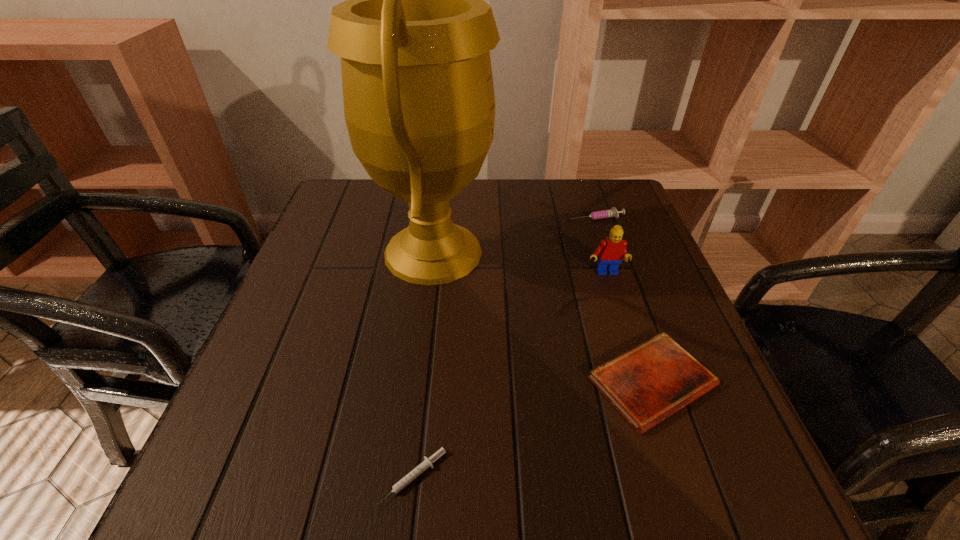
The width and height of the screenshot is (960, 540). What are the coordinates of `trophy` in the screenshot? It's located at (414, 35).

You are a GUI agent. You are given a task and a screenshot of the screen. Output one action in this format:
    pyautogui.click(x=<x>, y=<y>)
    Task: Click on the second tallest object
    The image size is (960, 540).
    Given the screenshot: What is the action you would take?
    pyautogui.click(x=612, y=250)

The width and height of the screenshot is (960, 540). Find the location of `the right syringe`. the right syringe is located at coordinates (613, 212).

Locate an element on the screen. This screenshot has height=540, width=960. the taller syringe is located at coordinates (613, 212).

Find the location of a particular element. The height and width of the screenshot is (540, 960). diary is located at coordinates (648, 383).

At what (x,y) coordinates should I click in order to perform the action: click on the shortest object. Please return your answer as a coordinate pair (x, y). The height and width of the screenshot is (540, 960). Looking at the image, I should click on (428, 462).

Identify the location of the nearest object. (428, 462).

The image size is (960, 540). Identify the location of vacant region located 0.320m on the engravings side of the trophy. (633, 252).

At what (x,y) coordinates should I click in order to perform the action: click on free region located 0.220m on the front-facing side of the Lego. Please return your answer as a coordinate pair (x, y). Image resolution: width=960 pixels, height=540 pixels. Looking at the image, I should click on (634, 363).

Find the location of a particular element. The height and width of the screenshot is (540, 960). vacant space located 0.100m on the front of the third tallest object is located at coordinates point(607,247).